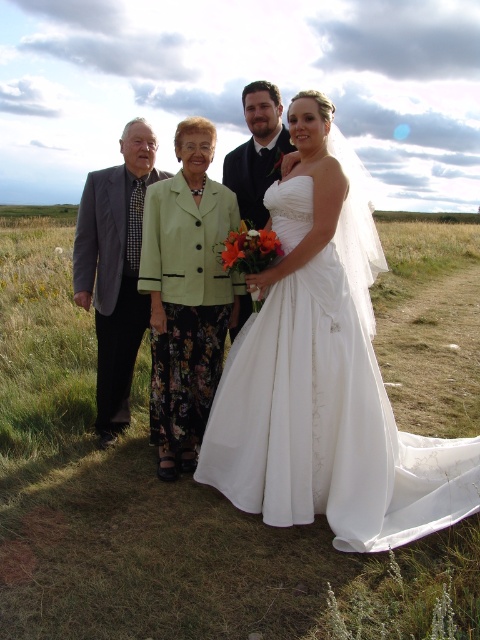
Question: From the image, what is the correct spatial relationship of white satin wedding dress at center in relation to green fabric jacket at center?

Choices:
 (A) left
 (B) right

Answer: (B)

Question: Is green fabric jacket at center bigger than matte black suit at center?

Choices:
 (A) no
 (B) yes

Answer: (B)

Question: Among these objects, which one is nearest to the camera?

Choices:
 (A) white satin wedding dress at center
 (B) matte black suit at center
 (C) green fabric jacket at center

Answer: (A)

Question: Which of the following is the closest to the observer?

Choices:
 (A) gray suit at left
 (B) green fabric jacket at center
 (C) white satin wedding dress at center

Answer: (C)

Question: Based on their relative distances, which object is nearer to the white satin wedding dress at center?

Choices:
 (A) gray suit at left
 (B) matte black suit at center
 (C) green fabric jacket at center

Answer: (C)

Question: Does white satin wedding dress at center have a lesser width compared to green fabric jacket at center?

Choices:
 (A) yes
 (B) no

Answer: (B)